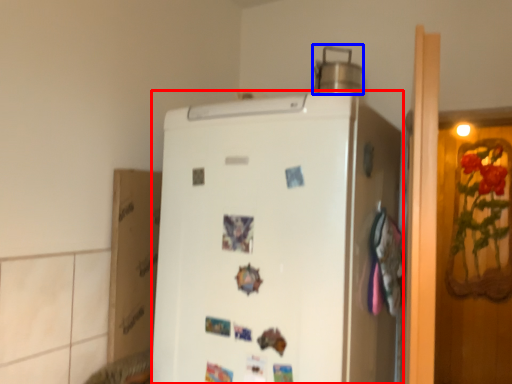
Question: Which object is closer to the camera taking this photo, refrigerator (highlighted by a red box) or appliance (highlighted by a blue box)?

Choices:
 (A) refrigerator
 (B) appliance

Answer: (A)